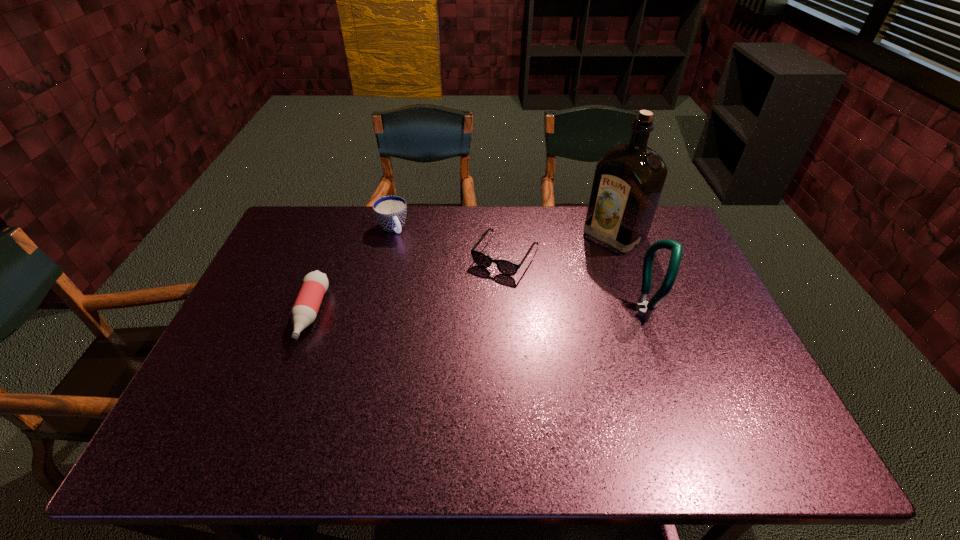
Where is `liquor located in the far edge section of the desktop`? This screenshot has width=960, height=540. liquor located in the far edge section of the desktop is located at coordinates (628, 181).

I want to click on sunglasses at the far edge, so click(x=508, y=268).

This screenshot has width=960, height=540. Find the location of `object located in the right edge section of the desktop`. object located in the right edge section of the desktop is located at coordinates (628, 181).

Find the location of `object that is positioned at the far right corner`. object that is positioned at the far right corner is located at coordinates (628, 181).

In the image, there is a desktop. Find the location of `vacant space at the far edge`. vacant space at the far edge is located at coordinates (479, 205).

Image resolution: width=960 pixels, height=540 pixels. In order to click on vacant space at the near edge of the desktop in this screenshot , I will do 546,387.

The height and width of the screenshot is (540, 960). In the image, there is a desktop. In order to click on free space at the left edge in this screenshot , I will do `click(216, 359)`.

Identify the location of vacant space at the right edge of the desktop. (693, 356).

You are a GUI agent. You are given a task and a screenshot of the screen. Output one action in this format:
    pyautogui.click(x=<x>, y=<y>)
    Task: Click on the free space at the near left corner of the desktop
    The width and height of the screenshot is (960, 540).
    Given the screenshot: What is the action you would take?
    pyautogui.click(x=207, y=384)

Find the location of a particular element. This screenshot has height=540, width=960. free space between the shortest object and the tallest object is located at coordinates (560, 245).